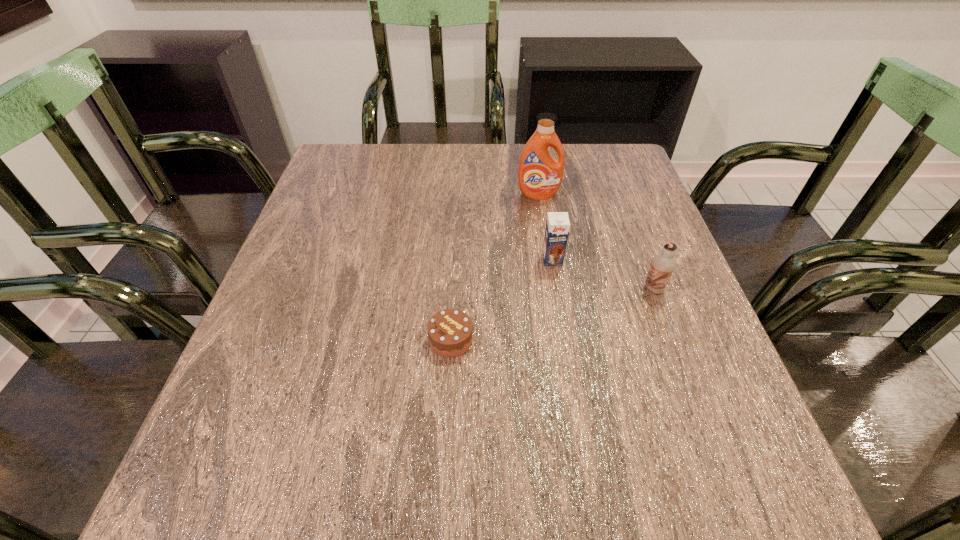
Where is `vacant space at the far right corner of the desktop`? vacant space at the far right corner of the desktop is located at coordinates (583, 171).

Where is `free space at the near right corner of the desktop`? This screenshot has height=540, width=960. free space at the near right corner of the desktop is located at coordinates (767, 487).

The height and width of the screenshot is (540, 960). Identify the location of vacant point located between the right chocolate milk and the leftmost object. pyautogui.click(x=552, y=314).

Identify the location of empty space that is in between the shortest object and the detergent. (494, 267).

Identify the location of vacant space that's between the leftmost object and the left chocolate milk. Image resolution: width=960 pixels, height=540 pixels. (502, 300).

Find the location of `empty space between the farther chocolate milk and the tallest object`. empty space between the farther chocolate milk and the tallest object is located at coordinates click(545, 227).

The width and height of the screenshot is (960, 540). I want to click on free point between the tallest object and the right chocolate milk, so click(596, 241).

You are a GUI agent. You are given a task and a screenshot of the screen. Output one action in this format:
    pyautogui.click(x=<x>, y=<y>)
    Task: Click on the vacant area that lies between the detergent and the farther chocolate milk
    
    Given the screenshot: What is the action you would take?
    pyautogui.click(x=545, y=227)

The height and width of the screenshot is (540, 960). I want to click on free space between the leftmost object and the rightmost object, so click(x=552, y=314).

This screenshot has height=540, width=960. Find the location of `free space between the nearer chocolate milk and the tallest object`. free space between the nearer chocolate milk and the tallest object is located at coordinates (596, 241).